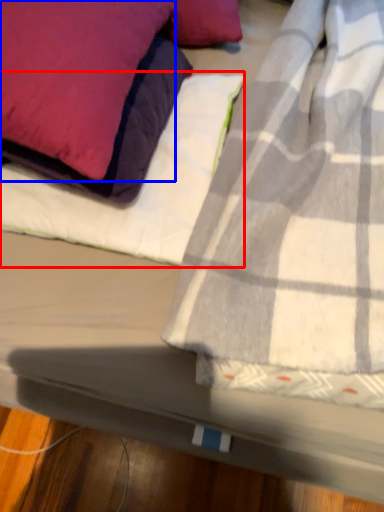
Question: Which point is closer to the camera, sheet (highlighted by a red box) or pillow (highlighted by a blue box)?

Choices:
 (A) sheet
 (B) pillow

Answer: (B)